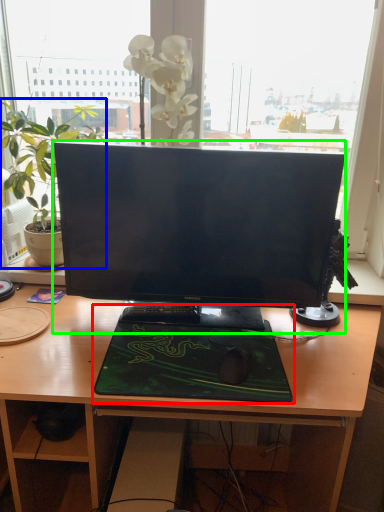
Question: Which object is the closest to the desktop (highlighted by a red box)? Choose among these: houseplant (highlighted by a blue box) or computer monitor (highlighted by a green box).

Choices:
 (A) houseplant
 (B) computer monitor

Answer: (B)